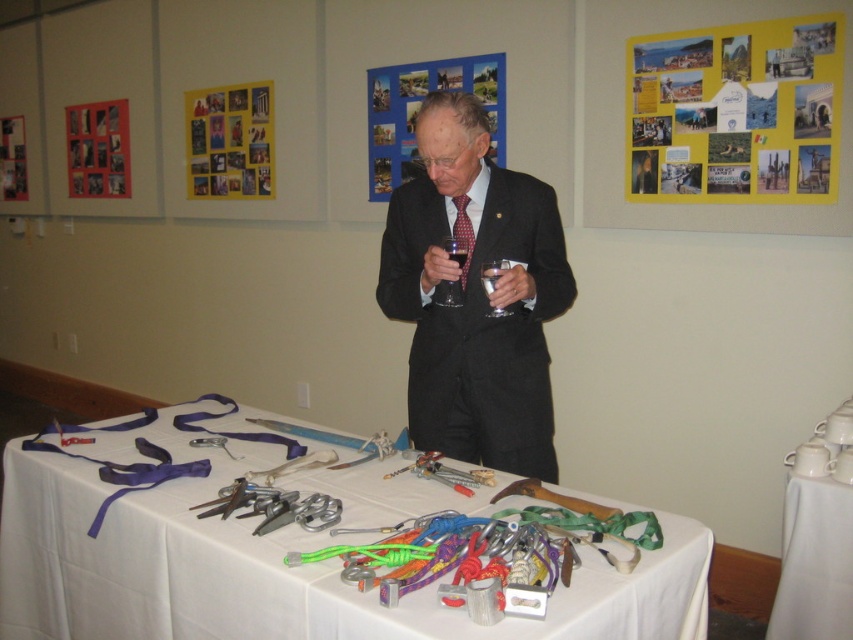
Question: Which point is farther to the camera?

Choices:
 (A) clear glass wine glass at center
 (B) red checkered tie at center
 (C) yellow matte poster at upper center
 (D) white fabric table at lower right

Answer: (C)

Question: Which object is closer to the camera taking this photo?

Choices:
 (A) black matte suit at center
 (B) white fabric table at lower right
 (C) red checkered tie at center
 (D) multicolored plastic ropes at center

Answer: (D)

Question: Is multicolored plastic ropes at center closer to camera compared to yellow paper at upper right?

Choices:
 (A) no
 (B) yes

Answer: (B)

Question: Which of the following is the farthest from the observer?

Choices:
 (A) clear glass wine glass at center
 (B) black matte suit at center

Answer: (A)

Question: Can you confirm if white fabric table at lower right is smaller than red checkered tie at center?

Choices:
 (A) yes
 (B) no

Answer: (B)

Question: Observing the image, what is the correct spatial positioning of yellow paper at upper right in reference to yellow matte poster at upper center?

Choices:
 (A) below
 (B) above

Answer: (A)